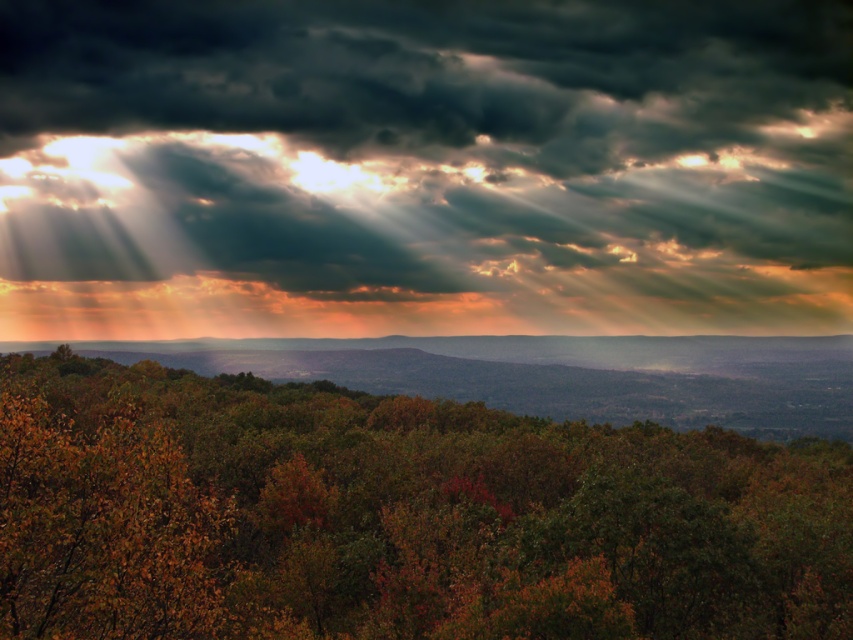
Measure the distance from dark gray cloud at upper center to green matte tree at center.

dark gray cloud at upper center and green matte tree at center are 374.56 feet apart from each other.

Is point (566, 209) farther from viewer compared to point (622, 470)?

Yes, point (566, 209) is farther from viewer.

The height and width of the screenshot is (640, 853). Identify the location of dark gray cloud at upper center. (424, 168).